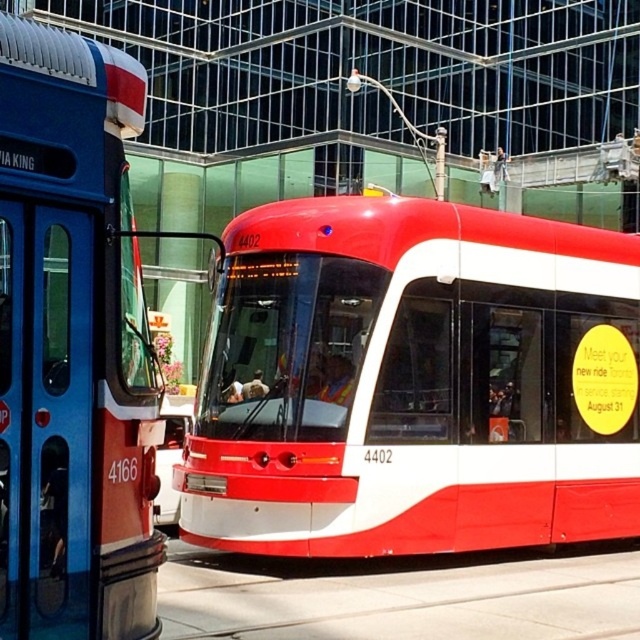
Question: Does shiny red bus at center appear on the left side of matte red bus at left?

Choices:
 (A) yes
 (B) no

Answer: (B)

Question: Which point is farther to the camera?

Choices:
 (A) shiny red bus at center
 (B) matte red bus at left

Answer: (A)

Question: Among these points, which one is nearest to the camera?

Choices:
 (A) (51, 637)
 (B) (282, 227)

Answer: (A)

Question: Observing the image, what is the correct spatial positioning of shiny red bus at center in reference to matte red bus at left?

Choices:
 (A) right
 (B) left

Answer: (A)

Question: Which point is farther to the camera?

Choices:
 (A) matte red bus at left
 (B) shiny red bus at center

Answer: (B)

Question: Considering the relative positions of shiny red bus at center and matte red bus at left in the image provided, where is shiny red bus at center located with respect to matte red bus at left?

Choices:
 (A) below
 (B) above

Answer: (A)